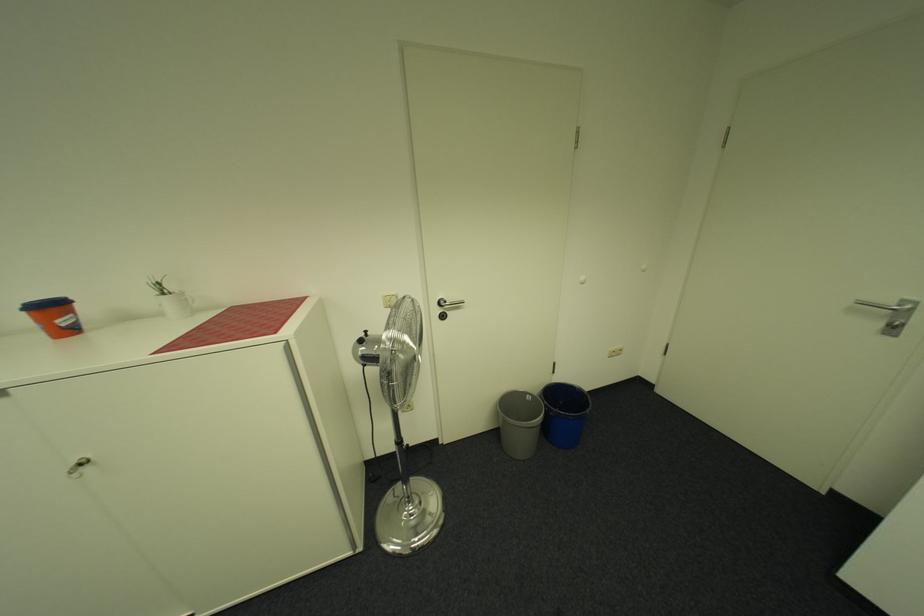
You are a GUI agent. You are given a task and a screenshot of the screen. Output one action in this format:
    pyautogui.click(x=<x>, y=<y>)
    Task: Click on the orange cup
    This screenshot has height=616, width=924.
    Given the screenshot: What is the action you would take?
    pyautogui.click(x=54, y=315)